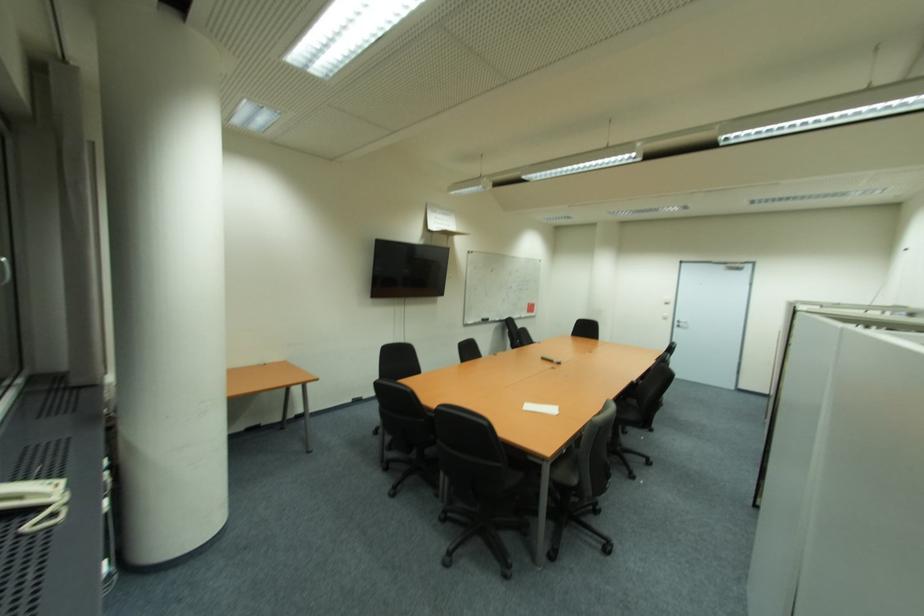
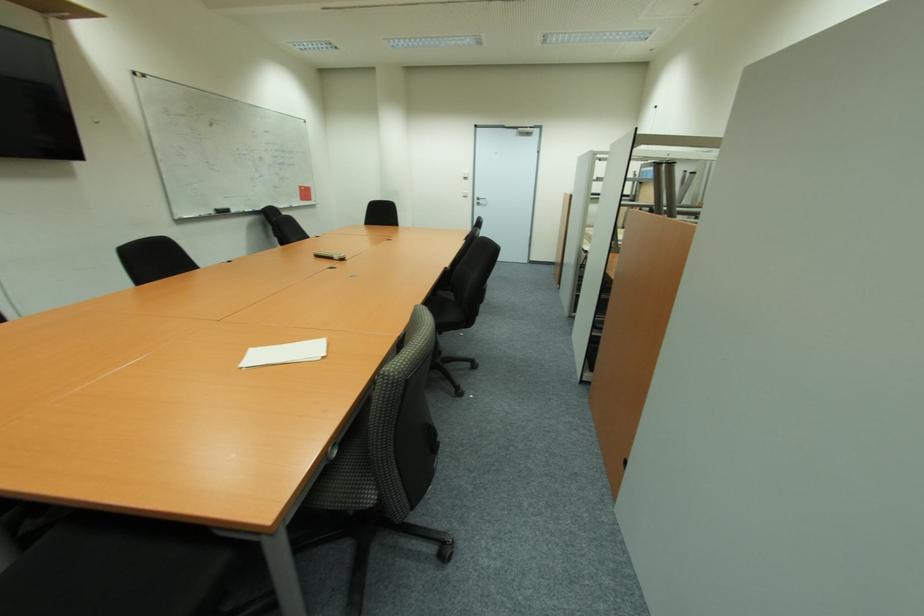
The point at [686,325] is marked in the first image. Where is the corresponding point in the second image?

(483, 203)